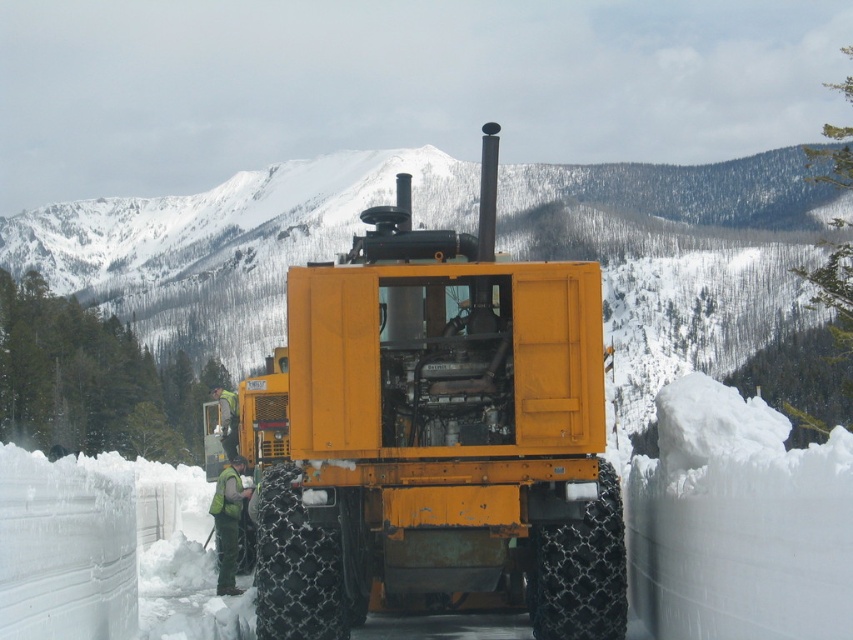
Does green fabric vest at center come in front of green fabric jacket at center?

Yes, green fabric vest at center is in front of green fabric jacket at center.

Is point (222, 500) positioned behind point (236, 394)?

No, it is in front of (236, 394).

The width and height of the screenshot is (853, 640). I want to click on green fabric vest at center, so click(x=228, y=522).

Who is more forward, [508,554] or [538,621]?

Point [508,554] is in front.

Who is more forward, (412, 275) or (589, 572)?

Positioned in front is point (412, 275).

This screenshot has width=853, height=640. In order to click on matte yellow tractor at center in this screenshot , I will do `click(436, 433)`.

Does black chain-link tire at center have a larger size compared to green fabric vest at center?

Yes.

Between point (286, 541) and point (231, 580), which one is positioned behind?

The point (231, 580) is behind.

Identify the location of black chain-link tire at center. The width and height of the screenshot is (853, 640). (296, 564).